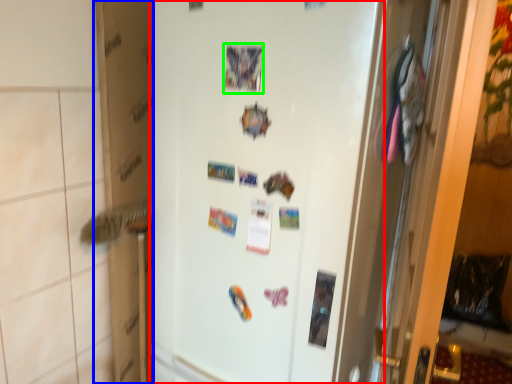
Question: Considering the real-world distances, which object is closest to refrigerator (highlighted by a red box)? cardboard box (highlighted by a blue box) or postcard (highlighted by a green box).

Choices:
 (A) cardboard box
 (B) postcard

Answer: (B)